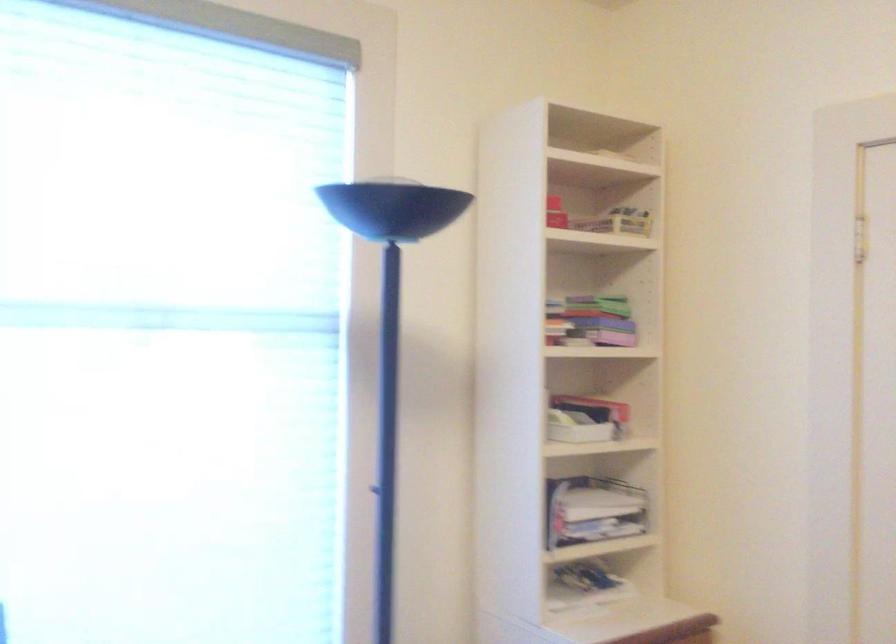
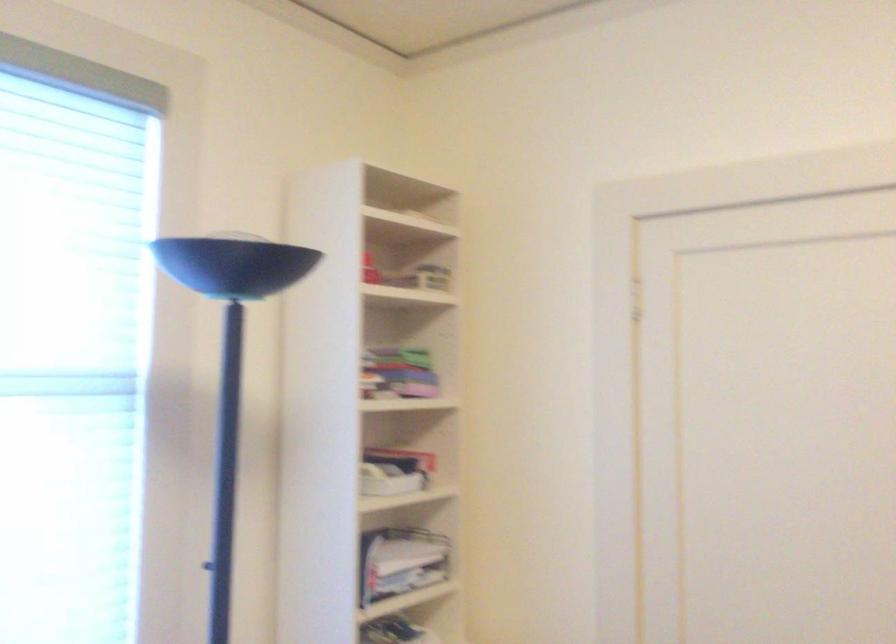
Question: The images are taken continuously from a first-person perspective. In which direction are you moving?

Choices:
 (A) Left
 (B) Right
 (C) Forward
 (D) Backward

Answer: (A)